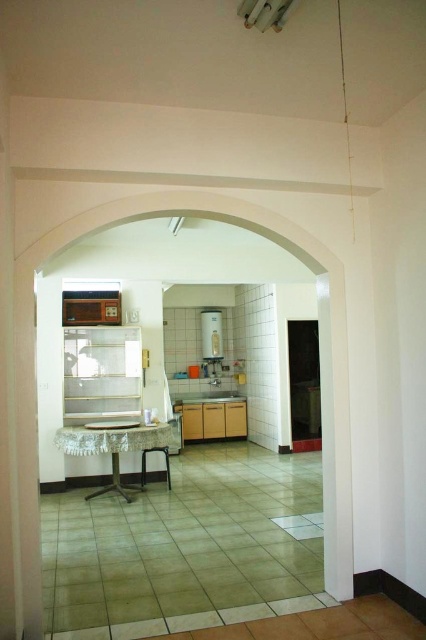
You are trying to place a tall plant pot that requires a surface at least 1 meter in height. Given the white lace table at center and the white glossy refrigerator at center, which object can support the plant pot?

The white glossy refrigerator at center is taller than the white lace table at center, so it can support the plant pot as it meets the height requirement of at least 1 meter.

You are standing in the living room and looking through the arched doorway into the kitchen. You see the white lace table at center and the white glossy refrigerator at center. Which object is closer to you?

The white lace table at center is closer to the viewer than the white glossy refrigerator at center.

You are moving a box from the kitchen entrance to the living room. The path goes between the white lace table at center and the white glossy refrigerator at center. Is there enough space to pass through?

The white lace table at center is positioned under the white glossy refrigerator at center, so there is sufficient vertical space to move the box between them. However, since the table and refrigerator are both at center, their horizontal placement might block the path. Check the exact dimensions for clearance.